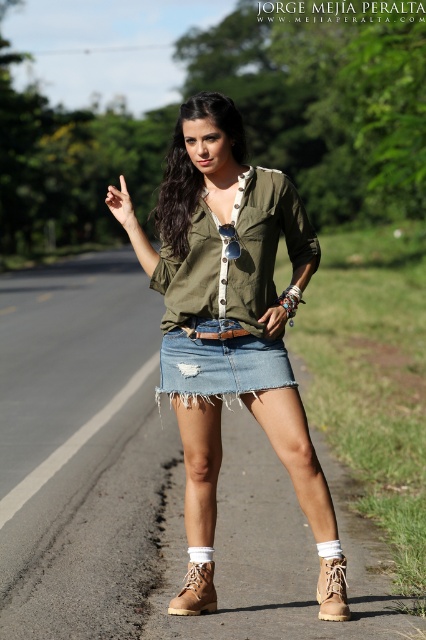
You are a fashion designer observing the outfit of a model standing on a paved road. The model is wearing a ripped denim skirt at center and a tan suede boot at lower center. Which item of clothing is bigger in size?

The ripped denim skirt at center is larger in size compared to the tan suede boot at lower center.

You are navigating a path in a rural area and see two landmarks marked as point coordinates. If you are facing north, which point would be further north? The points are point (x=224, y=260) and point (x=340, y=608).

Point (x=340, y=608) is further north because it has a higher y coordinate value than point (x=224, y=260).